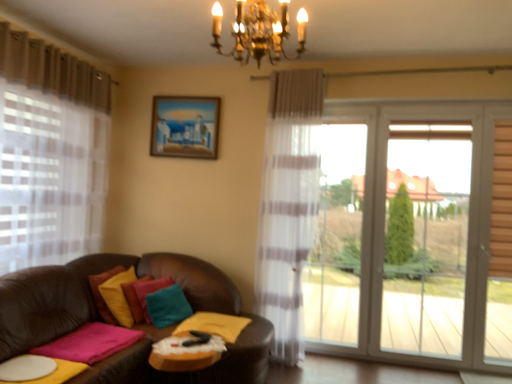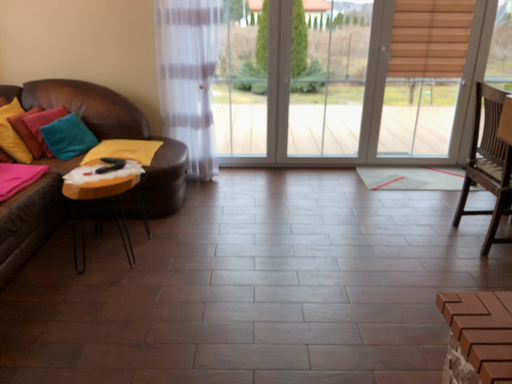
Question: Which way did the camera rotate in the video?

Choices:
 (A) rotated upward
 (B) rotated downward

Answer: (B)